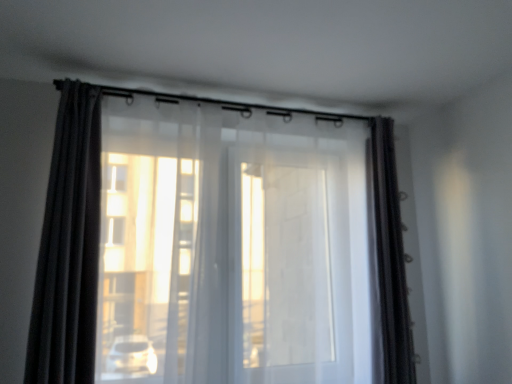
Question: Is the position of transparent fabric curtain at center, the 2th curtain from the right, less distant than that of satin dark brown curtain at right, which is the 1th curtain in right-to-left order?

Choices:
 (A) no
 (B) yes

Answer: (B)

Question: From the image's perspective, does transparent fabric curtain at center, which ranks as the second curtain in left-to-right order, appear higher than satin dark brown curtain at right, the third curtain in the left-to-right sequence?

Choices:
 (A) yes
 (B) no

Answer: (B)

Question: Is transparent fabric curtain at center, which ranks as the second curtain in left-to-right order, at the left side of satin dark brown curtain at right, which is the 1th curtain in right-to-left order?

Choices:
 (A) no
 (B) yes

Answer: (B)

Question: Would you say satin dark brown curtain at right, which is the 1th curtain in right-to-left order, is part of transparent fabric curtain at center, the 2th curtain from the right,'s contents?

Choices:
 (A) no
 (B) yes

Answer: (A)

Question: Would you consider transparent fabric curtain at center, which ranks as the second curtain in left-to-right order, to be distant from satin dark brown curtain at right, the third curtain in the left-to-right sequence?

Choices:
 (A) no
 (B) yes

Answer: (A)

Question: Considering the relative sizes of transparent fabric curtain at center, which ranks as the second curtain in left-to-right order, and satin dark brown curtain at right, which is the 1th curtain in right-to-left order, in the image provided, is transparent fabric curtain at center, which ranks as the second curtain in left-to-right order, bigger than satin dark brown curtain at right, which is the 1th curtain in right-to-left order,?

Choices:
 (A) no
 (B) yes

Answer: (B)

Question: Is matte black curtain at left, which is the first curtain from left to right, thinner than transparent fabric curtain at center, which ranks as the second curtain in left-to-right order?

Choices:
 (A) no
 (B) yes

Answer: (A)

Question: Is matte black curtain at left, which is the first curtain from left to right, outside of transparent fabric curtain at center, which ranks as the second curtain in left-to-right order?

Choices:
 (A) no
 (B) yes

Answer: (B)

Question: Does matte black curtain at left, which is the first curtain from left to right, have a larger size compared to transparent fabric curtain at center, which ranks as the second curtain in left-to-right order?

Choices:
 (A) yes
 (B) no

Answer: (B)

Question: Can you confirm if matte black curtain at left, the third curtain viewed from the right, is taller than transparent fabric curtain at center, which ranks as the second curtain in left-to-right order?

Choices:
 (A) no
 (B) yes

Answer: (A)

Question: Is matte black curtain at left, which is the first curtain from left to right, shorter than transparent fabric curtain at center, the 2th curtain from the right?

Choices:
 (A) yes
 (B) no

Answer: (A)

Question: Is matte black curtain at left, which is the first curtain from left to right, next to transparent fabric curtain at center, which ranks as the second curtain in left-to-right order?

Choices:
 (A) no
 (B) yes

Answer: (A)

Question: Can you confirm if satin dark brown curtain at right, the third curtain in the left-to-right sequence, is bigger than matte black curtain at left, which is the first curtain from left to right?

Choices:
 (A) yes
 (B) no

Answer: (B)